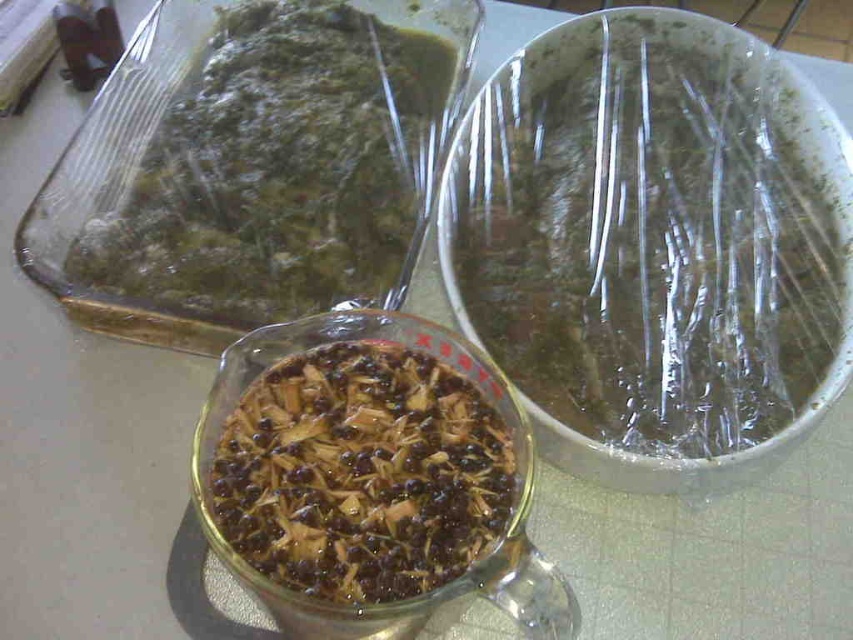
Is green matte cake at center closer to camera compared to brown matte glass bowl at center?

No, it is not.

What do you see at coordinates (279, 168) in the screenshot?
I see `green matte cake at center` at bounding box center [279, 168].

Which is in front, point (405, 193) or point (410, 492)?

Point (410, 492) is in front.

This screenshot has height=640, width=853. In order to click on green matte cake at center in this screenshot , I will do `click(279, 168)`.

Is point (595, 26) more distant than point (396, 548)?

That is True.

Who is positioned more to the right, transparent plastic bowl at upper right or brown matte glass bowl at center?

Positioned to the right is transparent plastic bowl at upper right.

Who is more distant from viewer, [770,81] or [419,444]?

The point [770,81] is behind.

You are a GUI agent. You are given a task and a screenshot of the screen. Output one action in this format:
    pyautogui.click(x=<x>, y=<y>)
    Task: Click on the transparent plastic bowl at upper right
    The image size is (853, 640).
    Given the screenshot: What is the action you would take?
    pyautogui.click(x=648, y=236)

Who is higher up, transparent plastic bowl at upper right or green matte cake at center?

green matte cake at center is higher up.

Between point (618, 136) and point (332, 266), which one is positioned in front?

Point (332, 266)

Does point (532, 308) lie in front of point (277, 308)?

No, it is behind (277, 308).

Identify the location of transparent plastic bowl at upper right. The height and width of the screenshot is (640, 853). pos(648,236).